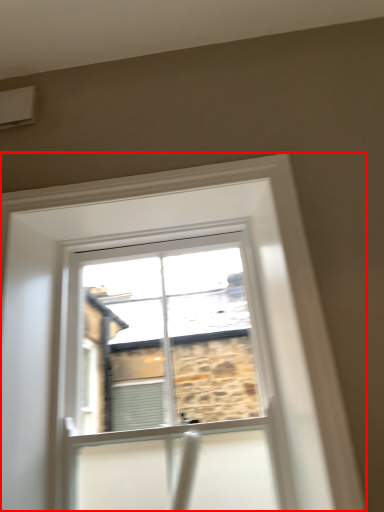
Question: From the image's perspective, where is window (annotated by the red box) located in relation to air conditioning in the image?

Choices:
 (A) below
 (B) above

Answer: (A)